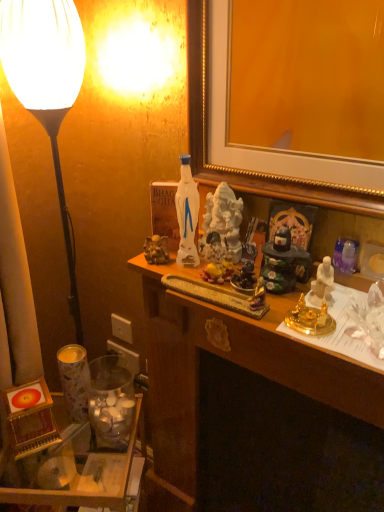
Where is `free space above wooden desk at center (from a real-world perspective)`? free space above wooden desk at center (from a real-world perspective) is located at coordinates (286, 306).